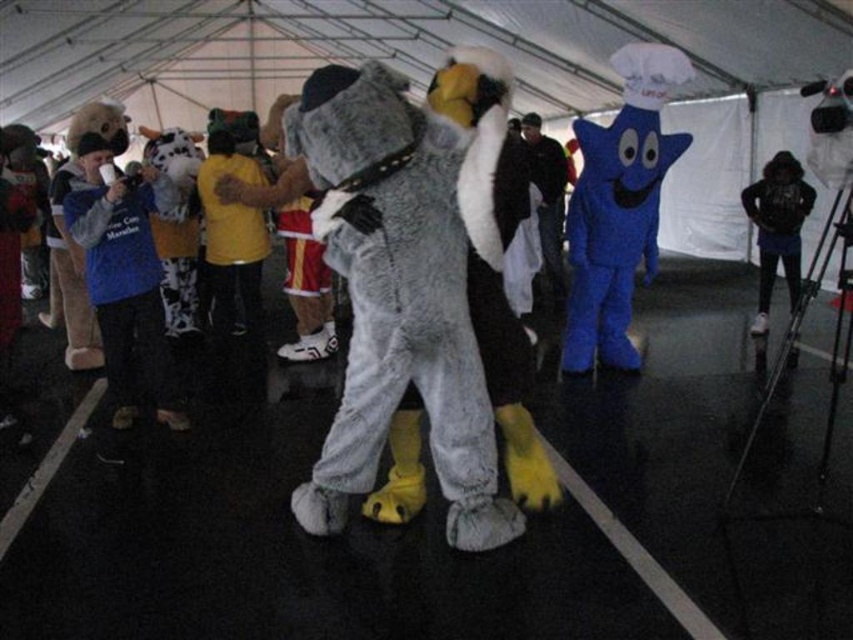
Question: Does blue fleece jacket at left appear over black backpack at right?

Choices:
 (A) no
 (B) yes

Answer: (A)

Question: Considering the real-world distances, which object is farthest from the black backpack at right?

Choices:
 (A) blue fleece jacket at left
 (B) blue plush star at center
 (C) fuzzy gray eagle at center
 (D) dark blue plush hat at center

Answer: (A)

Question: Which point appears closest to the camera in this image?

Choices:
 (A) (442, 136)
 (B) (646, 272)

Answer: (A)

Question: Does fuzzy gray eagle at center lie behind dark blue plush hat at center?

Choices:
 (A) no
 (B) yes

Answer: (A)

Question: Which object appears farthest from the camera in this image?

Choices:
 (A) black backpack at right
 (B) dark blue plush hat at center
 (C) blue plush star at center
 (D) fuzzy gray eagle at center

Answer: (B)

Question: Does fuzzy gray eagle at center appear over blue plush star at center?

Choices:
 (A) no
 (B) yes

Answer: (A)